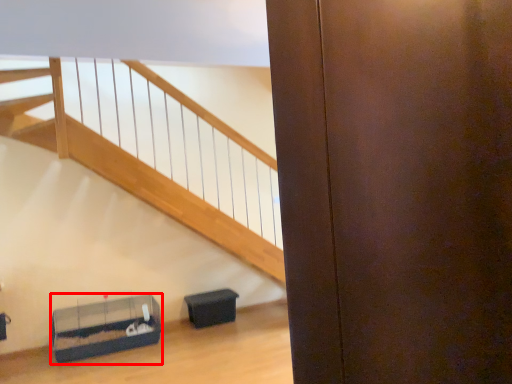
Question: From the image's perspective, where is furniture (annotated by the red box) located relative to furniture?

Choices:
 (A) above
 (B) below

Answer: (B)